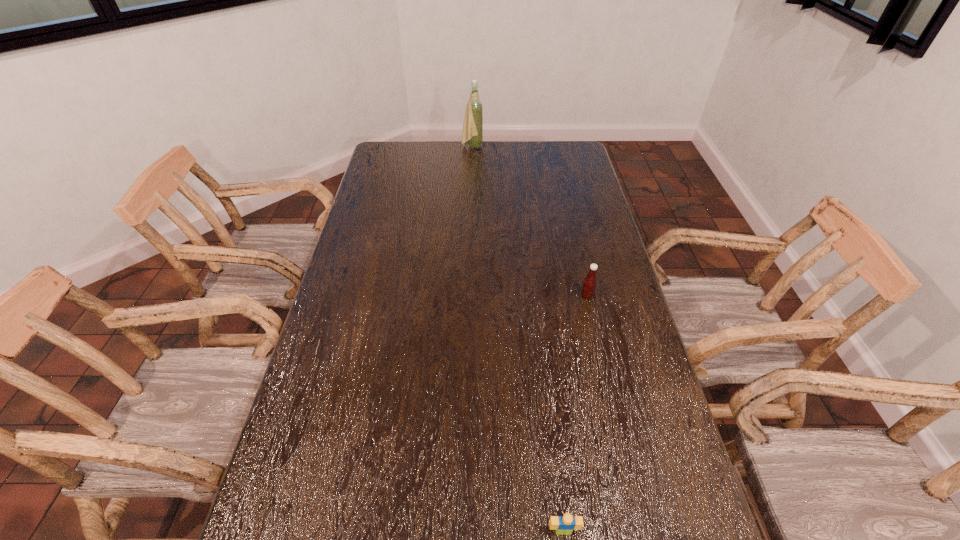
I want to click on blank space at the far edge of the desktop, so click(483, 164).

In the image, there is a desktop. Identify the location of vacant space at the left edge. (313, 467).

Image resolution: width=960 pixels, height=540 pixels. What are the coordinates of `vacant region at the right edge of the desktop` in the screenshot? It's located at (624, 307).

Identify the location of free space between the nearest object and the tallest object. The width and height of the screenshot is (960, 540). (517, 339).

At what (x,y) coordinates should I click in order to perform the action: click on unoccupied position between the Tabasco sauce and the second object from left to right. Please return your answer as a coordinate pair (x, y). Looking at the image, I should click on (575, 413).

Locate an element on the screen. The width and height of the screenshot is (960, 540). free space between the nearest object and the second nearest object is located at coordinates (575, 413).

In order to click on blank region between the Tabasco sauce and the wine bottle in this screenshot , I will do `click(530, 221)`.

Identify the location of free space that is in between the wine bottle and the Lego. (517, 339).

The image size is (960, 540). In order to click on the second closest object to the second tallest object in this screenshot , I will do `click(472, 132)`.

Where is `object that can be found as the second closest to the farthest object`? This screenshot has height=540, width=960. object that can be found as the second closest to the farthest object is located at coordinates (565, 524).